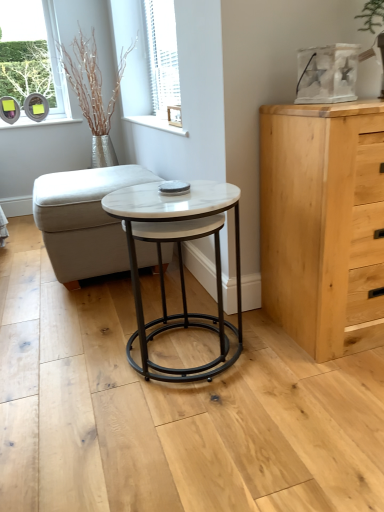
The width and height of the screenshot is (384, 512). Find the location of `free spot below white marble coffee table at center (from a real-world perspective)`. free spot below white marble coffee table at center (from a real-world perspective) is located at coordinates (183, 345).